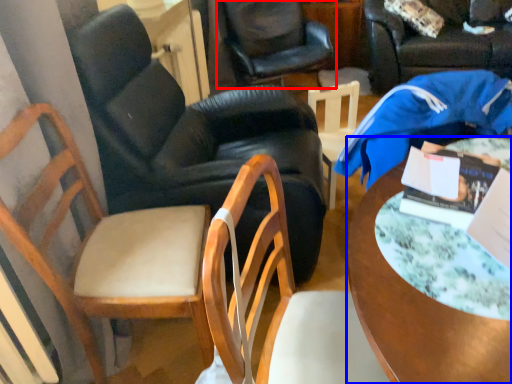
Question: Which of the following is the closest to the observer, chair (highlighted by a red box) or desk (highlighted by a blue box)?

Choices:
 (A) chair
 (B) desk

Answer: (B)